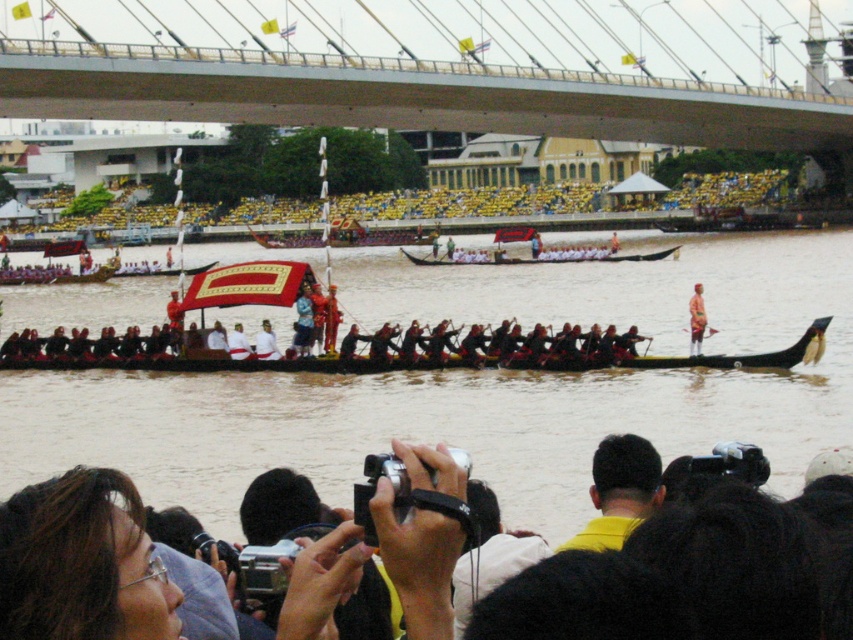
Is concrete bridge at upper center positioned in front of white glossy canoe at center?

Yes, it is.

Is point (103, 45) in front of point (440, 262)?

Yes, it is in front of point (440, 262).

Locate an element on the screen. The image size is (853, 640). concrete bridge at upper center is located at coordinates (404, 96).

Is point (366, 420) positioned before point (608, 547)?

No, it is not.

This screenshot has height=640, width=853. I want to click on brown water at center, so click(x=474, y=385).

This screenshot has width=853, height=640. What do you see at coordinates (474, 385) in the screenshot? I see `brown water at center` at bounding box center [474, 385].

You are a GUI agent. You are given a task and a screenshot of the screen. Output one action in this format:
    pyautogui.click(x=<x>, y=<y>)
    Task: Click on the brown water at center
    The image size is (853, 640).
    Given the screenshot: What is the action you would take?
    pyautogui.click(x=474, y=385)

Which is more to the left, yellow plastic seats at upper center or red velvet robe at center?

Positioned to the left is yellow plastic seats at upper center.

Does yellow plastic seats at upper center appear under red velvet robe at center?

Incorrect, yellow plastic seats at upper center is not positioned below red velvet robe at center.

Who is more forward, (x=550, y=205) or (x=267, y=356)?

Positioned in front is point (x=267, y=356).

Find the location of a particular element. The height and width of the screenshot is (640, 853). yellow plastic seats at upper center is located at coordinates (468, 204).